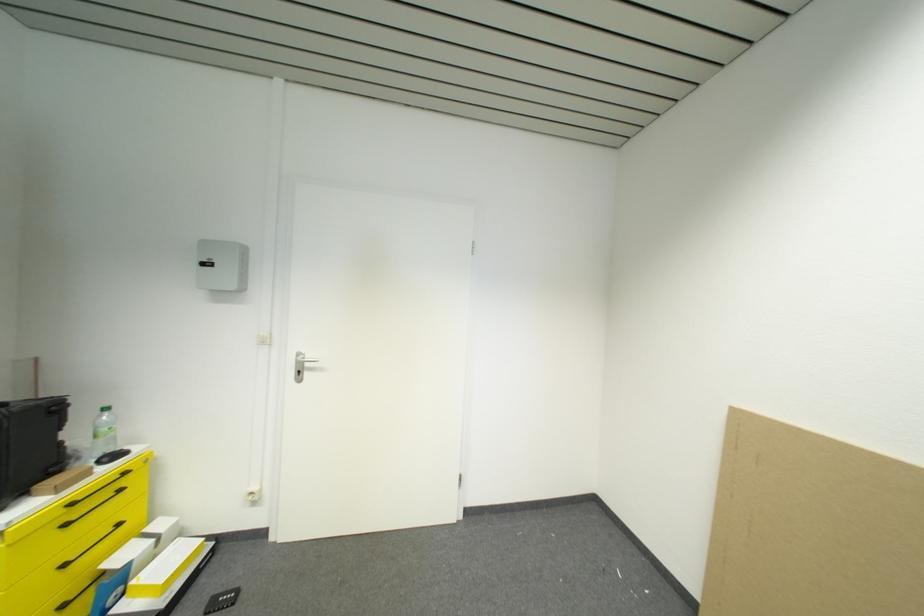
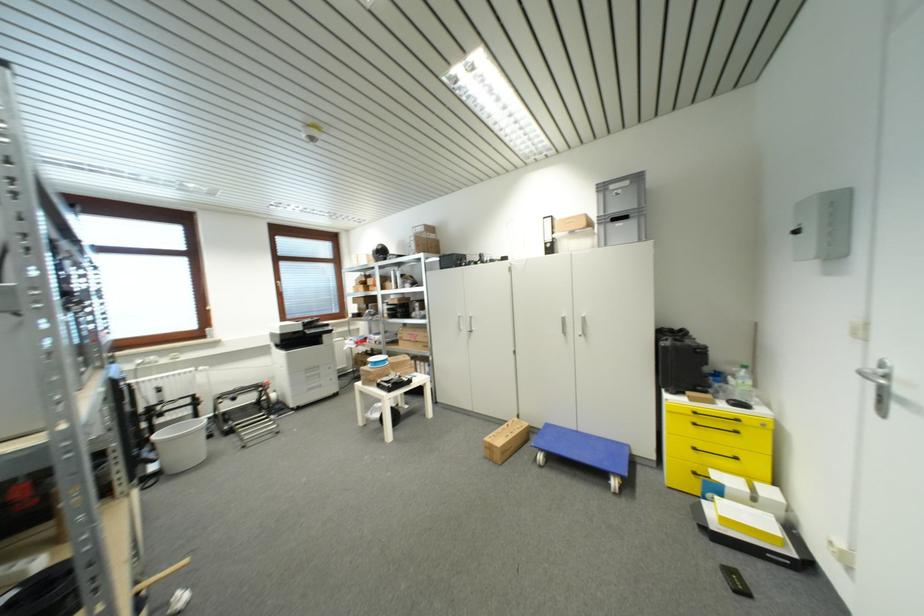
Locate, in the second image, the point that corresponds to point 111,418 in the first image.

(748, 374)